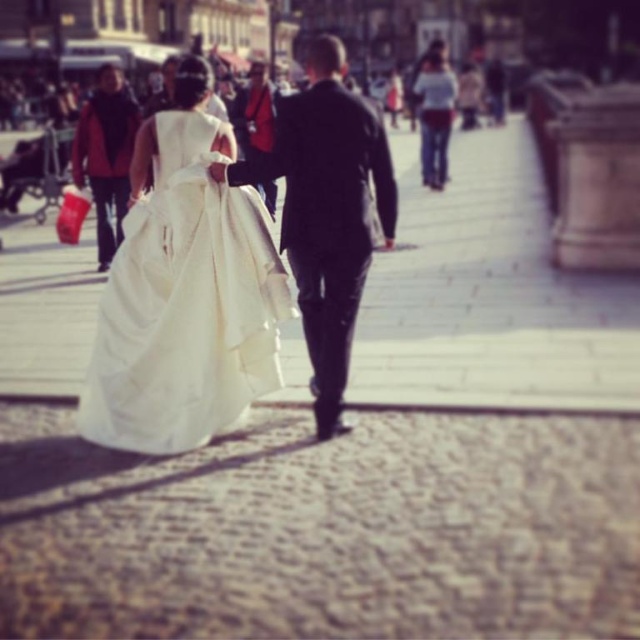
Between ivory satin dress at center and shiny black suit at center, which one is positioned higher?

Positioned higher is shiny black suit at center.

From the picture: Between ivory satin dress at center and shiny black suit at center, which one appears on the left side from the viewer's perspective?

Positioned to the left is ivory satin dress at center.

Who is more distant from viewer, [204,369] or [291,188]?

The point [291,188] is more distant.

Identify the location of ivory satin dress at center. (186, 305).